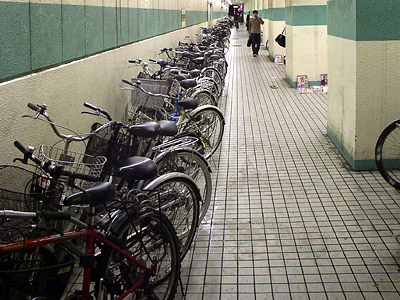
What are the coordinates of `white tile floor` in the screenshot? It's located at (283, 136).